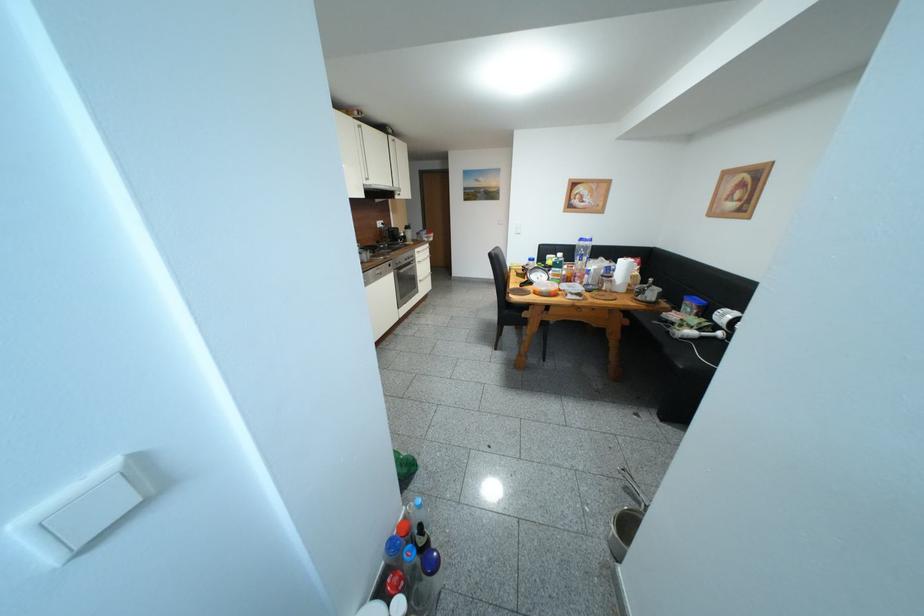
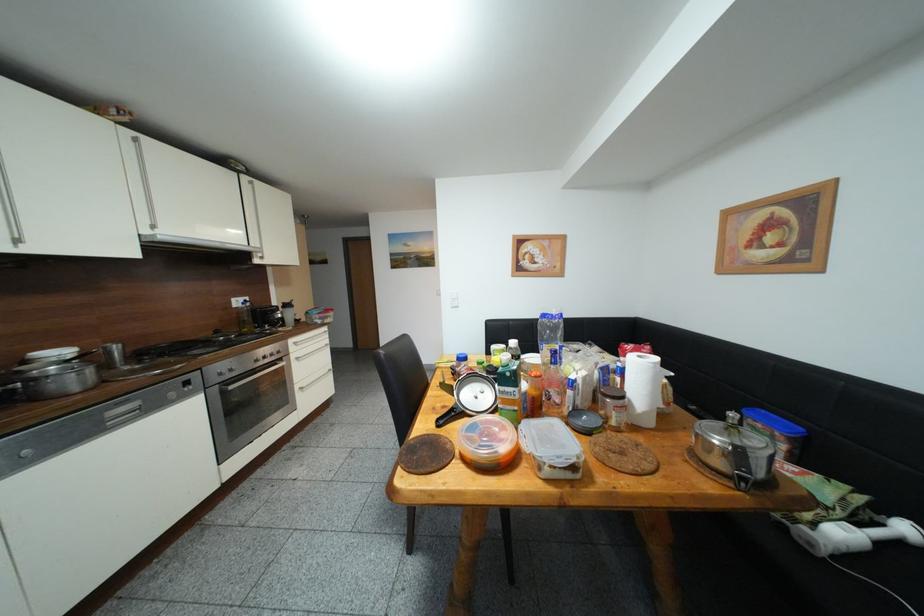
Which direction would the cameraman need to move to produce the second image?

The cameraman moved toward right, forward.